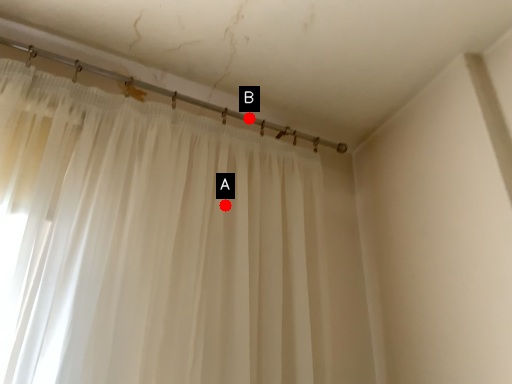
Question: Two points are circled on the image, labeled by A and B beside each circle. Which point is closer to the camera?

Choices:
 (A) A is closer
 (B) B is closer

Answer: (A)